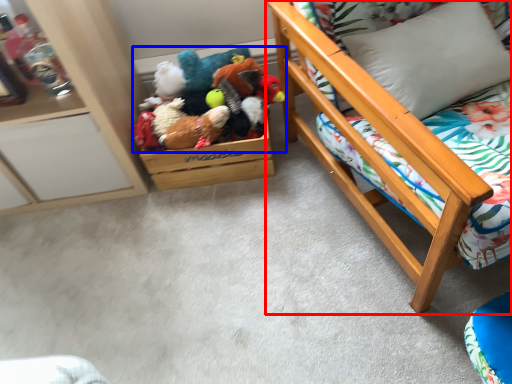
Question: Which of the following is the farthest to the observer, furniture (highlighted by a red box) or toy (highlighted by a blue box)?

Choices:
 (A) furniture
 (B) toy

Answer: (B)